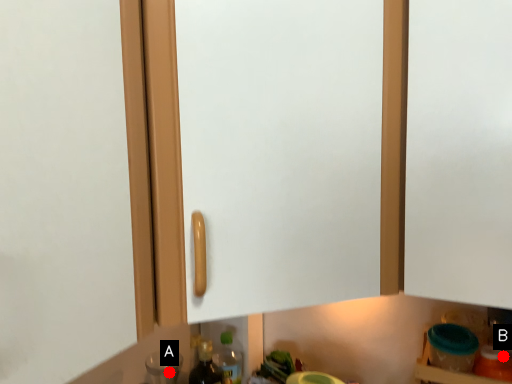
Question: Two points are circled on the image, labeled by A and B beside each circle. Which point appears farthest from the camera in this image?

Choices:
 (A) A is further
 (B) B is further

Answer: (A)